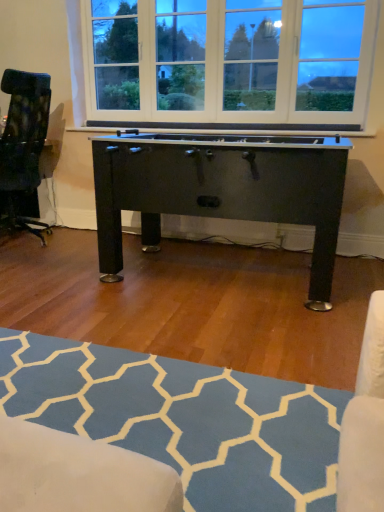
The width and height of the screenshot is (384, 512). I want to click on free space below blue textured rug at lower center (from a real-world perspective), so [x=169, y=419].